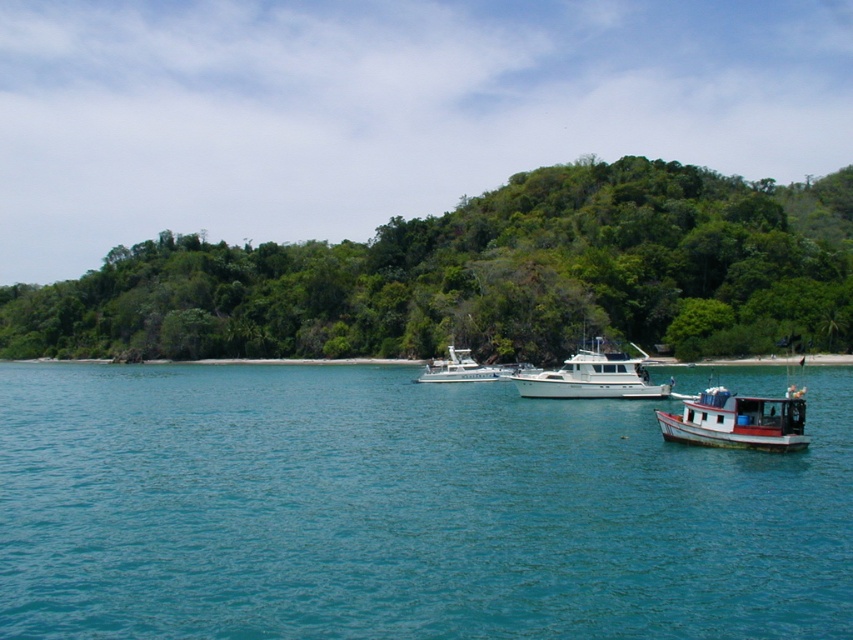
Between green leafy trees at center and white matte boat at lower right, which one appears on the right side from the viewer's perspective?

From the viewer's perspective, white matte boat at lower right appears more on the right side.

Between green leafy trees at center and white matte boat at lower right, which one appears on the left side from the viewer's perspective?

green leafy trees at center

This screenshot has width=853, height=640. What do you see at coordinates (485, 276) in the screenshot?
I see `green leafy trees at center` at bounding box center [485, 276].

Image resolution: width=853 pixels, height=640 pixels. Identify the location of green leafy trees at center. (485, 276).

Does clear blue water at center come in front of white glossy boat at center?

Yes, it is in front of white glossy boat at center.

Which is more to the left, clear blue water at center or white glossy boat at center?

clear blue water at center

What do you see at coordinates (402, 509) in the screenshot? The image size is (853, 640). I see `clear blue water at center` at bounding box center [402, 509].

Image resolution: width=853 pixels, height=640 pixels. I want to click on clear blue water at center, so click(x=402, y=509).

Measure the distance from white matte boat at lower right to white glossy yacht at center.

They are 35.97 meters apart.

From the picture: Is white matte boat at lower right shorter than white glossy yacht at center?

Yes.

Where is `white matte boat at lower right`? The image size is (853, 640). white matte boat at lower right is located at coordinates (737, 420).

Locate an element on the screen. The height and width of the screenshot is (640, 853). white matte boat at lower right is located at coordinates (737, 420).